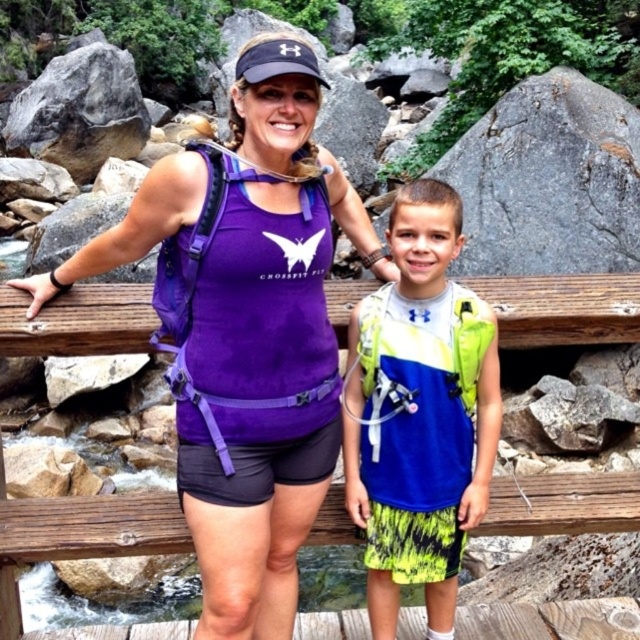
You are a tailor who needs to determine which item requires more fabric between the purple fabric tank top at center and the purple fabric bench at center. Based on their sizes, which one would need more fabric?

The purple fabric tank top at center requires more fabric because its width is larger than the purple fabric bench at center.

You are standing on the wooden bridge and want to place a small flag at the point closer to you between the two points marked as point (x=208, y=608) and point (x=596, y=284). Which point should you choose?

You should choose point (x=208, y=608) because it is closer to the viewer than point (x=596, y=284).